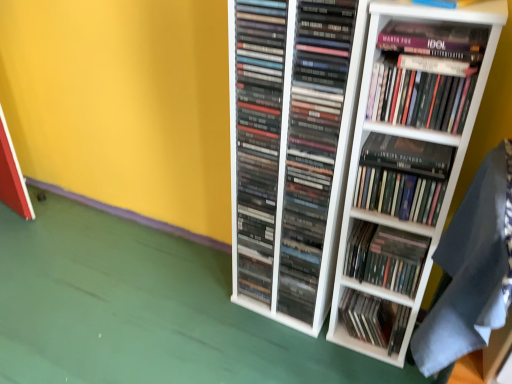
Question: Does matte black books at center, which is the second book from bottom to top, turn towards black matte book at upper right, which appears as the 6th book when ordered from the bottom?

Choices:
 (A) yes
 (B) no

Answer: (B)

Question: Is matte black books at center, the sixth book when ordered from top to bottom, looking in the opposite direction of black matte book at upper right, which appears as the 6th book when ordered from the bottom?

Choices:
 (A) yes
 (B) no

Answer: (B)

Question: From a real-world perspective, is matte black books at center, the sixth book when ordered from top to bottom, on black matte book at upper right, which is the second book in top-to-bottom order?

Choices:
 (A) yes
 (B) no

Answer: (B)

Question: Is matte black books at center, the sixth book when ordered from top to bottom, next to black matte book at upper right, which appears as the 6th book when ordered from the bottom?

Choices:
 (A) yes
 (B) no

Answer: (B)

Question: Does matte black books at center, the sixth book when ordered from top to bottom, come in front of black matte book at upper right, which appears as the 6th book when ordered from the bottom?

Choices:
 (A) yes
 (B) no

Answer: (B)

Question: Relative to matte black cds at center, the fifth book from the bottom, is hardcover book at upper right, which ranks as the seventh book in bottom-to-top order, in front or behind?

Choices:
 (A) front
 (B) behind

Answer: (A)

Question: Is hardcover book at upper right, which ranks as the seventh book in bottom-to-top order, inside the boundaries of matte black cds at center, which is the third book from top to bottom, or outside?

Choices:
 (A) outside
 (B) inside

Answer: (A)

Question: Looking at their shapes, would you say hardcover book at upper right, which is the 1th book from top to bottom, is wider or thinner than matte black cds at center, which is the third book from top to bottom?

Choices:
 (A) wide
 (B) thin

Answer: (B)

Question: Considering the positions of point (444, 84) and point (252, 246), is point (444, 84) closer or farther from the camera than point (252, 246)?

Choices:
 (A) closer
 (B) farther

Answer: (A)

Question: Considering the positions of matte black cds at center, the fifth book from the bottom, and matte black book at center, positioned as the first book in bottom-to-top order, in the image, is matte black cds at center, the fifth book from the bottom, bigger or smaller than matte black book at center, positioned as the first book in bottom-to-top order,?

Choices:
 (A) small
 (B) big

Answer: (B)

Question: Is matte black cds at center, which is the third book from top to bottom, inside the boundaries of matte black book at center, positioned as the first book in bottom-to-top order, or outside?

Choices:
 (A) inside
 (B) outside

Answer: (B)

Question: Visually, is matte black cds at center, which is the third book from top to bottom, positioned to the left or to the right of matte black book at center, positioned as the first book in bottom-to-top order?

Choices:
 (A) left
 (B) right

Answer: (A)

Question: In terms of width, does matte black cds at center, the fifth book from the bottom, look wider or thinner when compared to matte black book at center, positioned as the first book in bottom-to-top order?

Choices:
 (A) wide
 (B) thin

Answer: (A)

Question: Choose the correct answer: Is matte black books at center, acting as the 3th book starting from the bottom, inside dark gray fabric at lower right or outside it?

Choices:
 (A) inside
 (B) outside

Answer: (B)

Question: From the image's perspective, is matte black books at center, acting as the 3th book starting from the bottom, above or below dark gray fabric at lower right?

Choices:
 (A) below
 (B) above

Answer: (B)